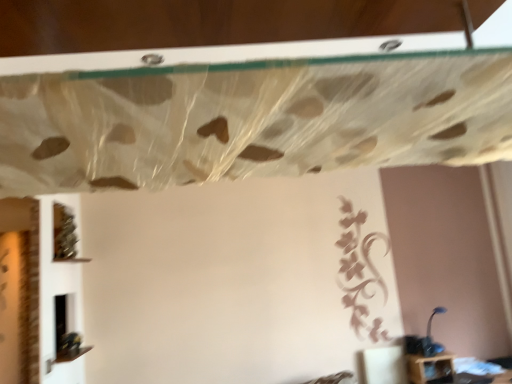
What do you see at coordinates (430, 335) in the screenshot? I see `blue plastic lamp at lower right` at bounding box center [430, 335].

This screenshot has height=384, width=512. I want to click on green matte vine at lower left, so click(64, 233).

From a real-world perspective, is green matte vine at lower left over blue plastic lamp at lower right?

Yes, from a real-world perspective, green matte vine at lower left is over blue plastic lamp at lower right

Does green matte vine at lower left have a lesser width compared to blue plastic lamp at lower right?

Indeed, green matte vine at lower left has a lesser width compared to blue plastic lamp at lower right.

Could you tell me if green matte vine at lower left is facing blue plastic lamp at lower right?

Yes, green matte vine at lower left is oriented towards blue plastic lamp at lower right.

From the image's perspective, is green matte vine at lower left beneath blue plastic lamp at lower right?

Actually, green matte vine at lower left appears above blue plastic lamp at lower right in the image.

Does green matte vine at lower left have a lesser height compared to translucent plastic curtain at upper center?

Incorrect, the height of green matte vine at lower left does not fall short of that of translucent plastic curtain at upper center.

Is point (57, 208) less distant than point (263, 77)?

No, (57, 208) is behind (263, 77).

Considering the positions of objects green matte vine at lower left and translucent plastic curtain at upper center in the image provided, who is in front, green matte vine at lower left or translucent plastic curtain at upper center?

translucent plastic curtain at upper center is closer to the camera.

Considering the sizes of objects green matte vine at lower left and translucent plastic curtain at upper center in the image provided, who is thinner, green matte vine at lower left or translucent plastic curtain at upper center?

green matte vine at lower left is thinner.

How many degrees apart are the facing directions of blue plastic lamp at lower right and translucent plastic curtain at upper center?

They differ by 179 degrees in their facing directions.

Considering the positions of objects blue plastic lamp at lower right and translucent plastic curtain at upper center in the image provided, who is more to the right, blue plastic lamp at lower right or translucent plastic curtain at upper center?

blue plastic lamp at lower right.

Is point (428, 342) closer or farther from the camera than point (348, 114)?

Point (428, 342) is farther from the camera than point (348, 114).

Which is closer, (258, 116) or (424, 355)?

The point (258, 116) is closer to the camera.

Who is shorter, translucent plastic curtain at upper center or blue plastic lamp at lower right?

blue plastic lamp at lower right is shorter.

Is translucent plastic curtain at upper center to the left or to the right of blue plastic lamp at lower right in the image?

Based on their positions, translucent plastic curtain at upper center is located to the left of blue plastic lamp at lower right.

Based on their sizes in the image, would you say translucent plastic curtain at upper center is bigger or smaller than green matte vine at lower left?

Considering their sizes, translucent plastic curtain at upper center takes up more space than green matte vine at lower left.

Is translucent plastic curtain at upper center looking in the opposite direction of green matte vine at lower left?

That's not correct — translucent plastic curtain at upper center is not looking away from green matte vine at lower left.

Which object is closer to the camera, translucent plastic curtain at upper center or green matte vine at lower left?

translucent plastic curtain at upper center is more forward.

From the image's perspective, is blue plastic lamp at lower right on top of green matte vine at lower left?

Incorrect, from the image's perspective, blue plastic lamp at lower right is lower than green matte vine at lower left.

From their relative heights in the image, would you say blue plastic lamp at lower right is taller or shorter than green matte vine at lower left?

In the image, blue plastic lamp at lower right appears to be shorter than green matte vine at lower left.

Is blue plastic lamp at lower right bigger than green matte vine at lower left?

No.

Image resolution: width=512 pixels, height=384 pixels. What are the coordinates of `vine above the blue plastic lamp at lower right (from the image's perspective)` in the screenshot? It's located at (64, 233).

Where is `curtain on the right of the green matte vine at lower left`? This screenshot has width=512, height=384. curtain on the right of the green matte vine at lower left is located at coordinates (252, 120).

Based on their spatial positions, is translucent plastic curtain at upper center or green matte vine at lower left closer to blue plastic lamp at lower right?

The object closer to blue plastic lamp at lower right is green matte vine at lower left.

When comparing their distances from green matte vine at lower left, does translucent plastic curtain at upper center or blue plastic lamp at lower right seem further?

blue plastic lamp at lower right.

From the image, which object appears to be farther from green matte vine at lower left, blue plastic lamp at lower right or translucent plastic curtain at upper center?

blue plastic lamp at lower right lies further to green matte vine at lower left than the other object.

Based on the photo, which object lies further to the anchor point translucent plastic curtain at upper center, green matte vine at lower left or blue plastic lamp at lower right?

blue plastic lamp at lower right.

When comparing their distances from translucent plastic curtain at upper center, does blue plastic lamp at lower right or green matte vine at lower left seem further?

blue plastic lamp at lower right is further to translucent plastic curtain at upper center.

Considering their positions, is green matte vine at lower left positioned closer to blue plastic lamp at lower right than translucent plastic curtain at upper center?

The object closer to blue plastic lamp at lower right is green matte vine at lower left.

Locate an element on the screen. The image size is (512, 384). vine between translucent plastic curtain at upper center and blue plastic lamp at lower right from front to back is located at coordinates (64, 233).